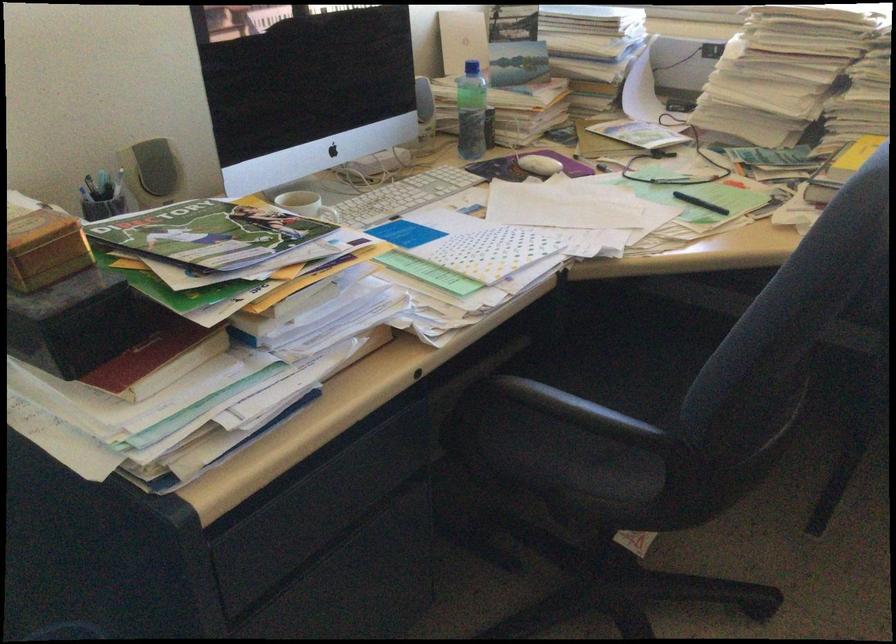
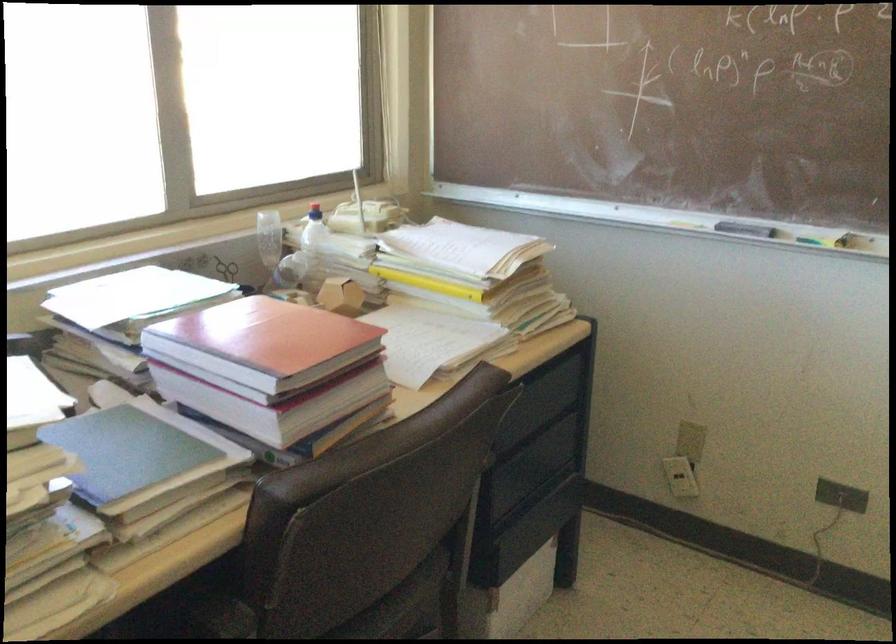
Based on the photo, based on the continuous images, in which direction is the camera rotating?

The rotation direction of the camera is right-down.